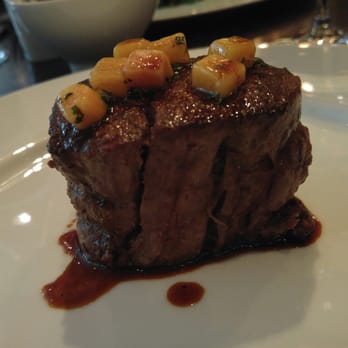
What are the coordinates of `plate` in the screenshot? It's located at (253, 272), (189, 8).